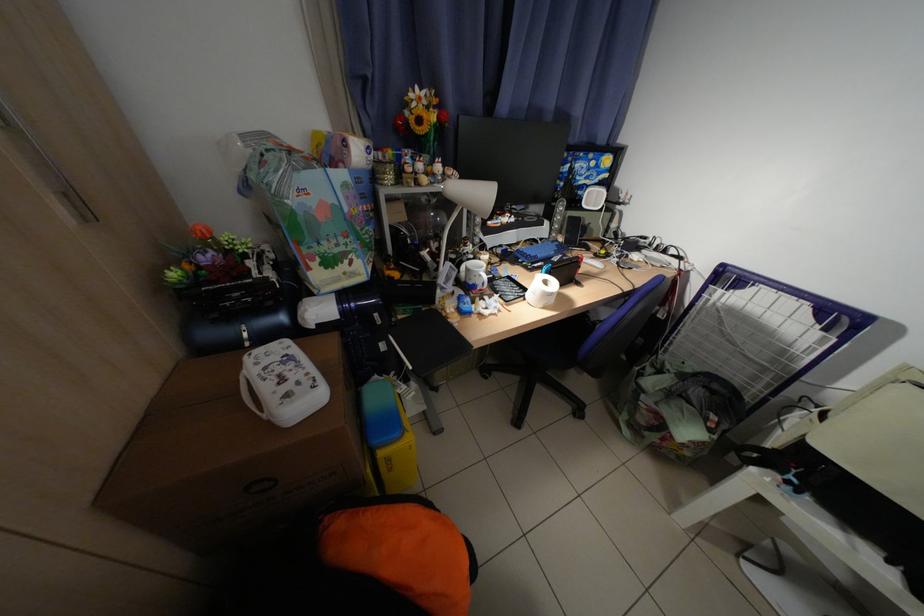
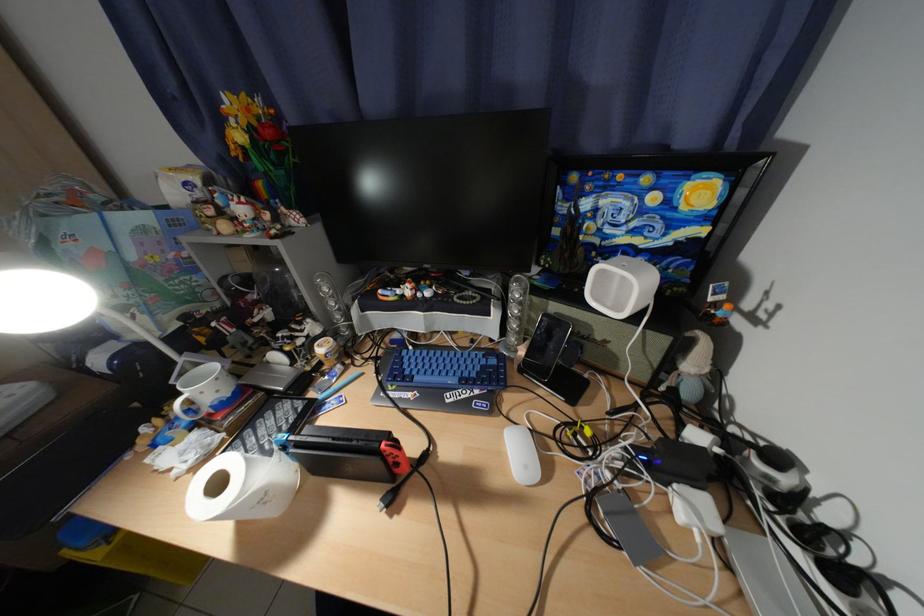
Where in the second image is the point corresponding to (590,268) from the first image?

(408, 466)